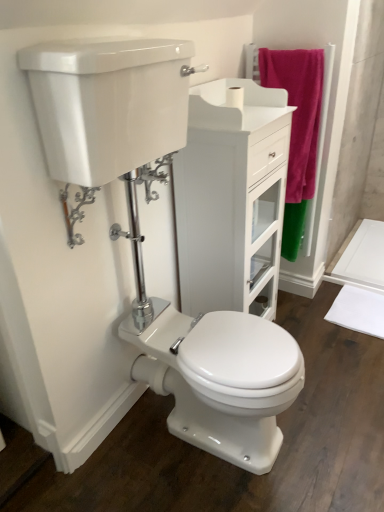
Question: From a real-world perspective, is polished chrome flush handle at center, marked as the 1th plumbing fixture in a back-to-front arrangement, positioned over white matte toilet paper at upper center based on gravity?

Choices:
 (A) no
 (B) yes

Answer: (A)

Question: Considering the relative positions of polished chrome flush handle at center, marked as the first plumbing fixture in a top-to-bottom arrangement, and white matte toilet paper at upper center in the image provided, is polished chrome flush handle at center, marked as the first plumbing fixture in a top-to-bottom arrangement, to the left of white matte toilet paper at upper center from the viewer's perspective?

Choices:
 (A) yes
 (B) no

Answer: (A)

Question: Is polished chrome flush handle at center, which is the second plumbing fixture from bottom to top, wider than white matte toilet paper at upper center?

Choices:
 (A) no
 (B) yes

Answer: (B)

Question: Considering the relative sizes of polished chrome flush handle at center, placed as the first plumbing fixture when sorted from right to left, and white matte toilet paper at upper center in the image provided, is polished chrome flush handle at center, placed as the first plumbing fixture when sorted from right to left, shorter than white matte toilet paper at upper center?

Choices:
 (A) yes
 (B) no

Answer: (B)

Question: Is polished chrome flush handle at center, which appears as the 2th plumbing fixture when viewed from the left, at the right side of white matte toilet paper at upper center?

Choices:
 (A) no
 (B) yes

Answer: (A)

Question: Is white matte toilet paper at upper center completely or partially inside polished chrome flush handle at center, marked as the 1th plumbing fixture in a back-to-front arrangement?

Choices:
 (A) yes
 (B) no

Answer: (B)

Question: From the image's perspective, is chrome metallic lever at upper left, the second plumbing fixture when ordered from top to bottom, above white matte toilet paper at upper center?

Choices:
 (A) yes
 (B) no

Answer: (B)

Question: Is chrome metallic lever at upper left, the second plumbing fixture from the right, facing towards white matte toilet paper at upper center?

Choices:
 (A) no
 (B) yes

Answer: (A)

Question: From the image's perspective, would you say chrome metallic lever at upper left, the second plumbing fixture when ordered from top to bottom, is shown under white matte toilet paper at upper center?

Choices:
 (A) yes
 (B) no

Answer: (A)

Question: From a real-world perspective, is chrome metallic lever at upper left, acting as the first plumbing fixture starting from the bottom, over white matte toilet paper at upper center?

Choices:
 (A) no
 (B) yes

Answer: (A)

Question: Is chrome metallic lever at upper left, which is counted as the 2th plumbing fixture, starting from the back, to the left of white matte toilet paper at upper center from the viewer's perspective?

Choices:
 (A) yes
 (B) no

Answer: (A)

Question: Considering the relative sizes of chrome metallic lever at upper left, the second plumbing fixture from the right, and white matte toilet paper at upper center in the image provided, is chrome metallic lever at upper left, the second plumbing fixture from the right, smaller than white matte toilet paper at upper center?

Choices:
 (A) no
 (B) yes

Answer: (A)

Question: Is chrome metallic lever at upper left, the second plumbing fixture from the right, taller than white glossy cabinet at center?

Choices:
 (A) yes
 (B) no

Answer: (B)